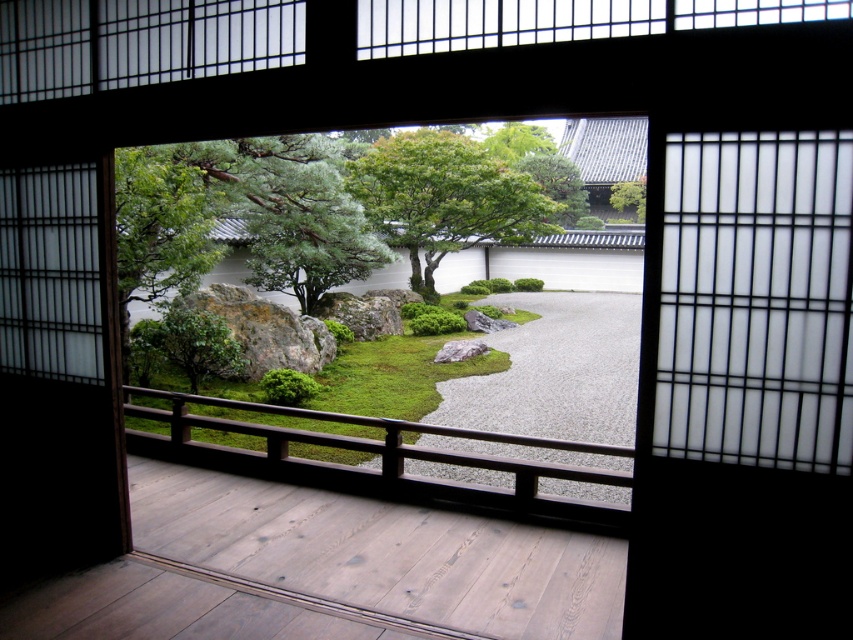
Question: Considering the real-world distances, which object is closest to the green leafy tree at upper right?

Choices:
 (A) green leafy tree at center
 (B) green matte tree at center

Answer: (A)

Question: Which point is closer to the camera?

Choices:
 (A) (790, 166)
 (B) (444, 376)
 (C) (558, 173)

Answer: (A)

Question: Can you confirm if green matte tree at center is positioned above green grassy rock at center?

Choices:
 (A) no
 (B) yes

Answer: (B)

Question: Is green matte tree at center bigger than green grassy rock at center?

Choices:
 (A) yes
 (B) no

Answer: (A)

Question: Estimate the real-world distances between objects in this image. Which object is farther from the white paper at left?

Choices:
 (A) white translucent screen at upper right
 (B) green leafy tree at upper right

Answer: (B)

Question: Is white translucent screen at upper right closer to camera compared to green textured tree at center?

Choices:
 (A) no
 (B) yes

Answer: (B)